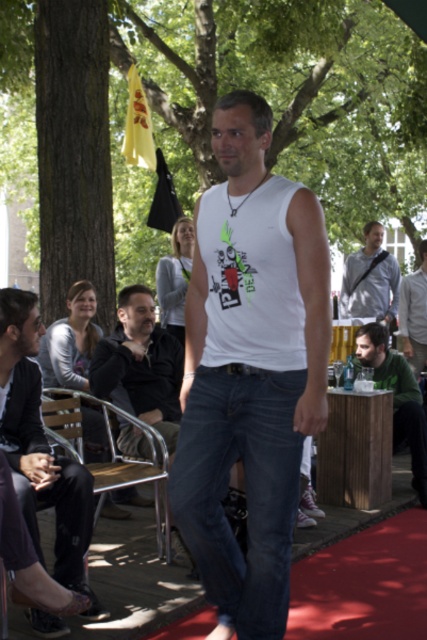
Question: Does white matte tank top at center have a larger size compared to woodenchair at left?

Choices:
 (A) no
 (B) yes

Answer: (A)

Question: Which object appears closest to the camera in this image?

Choices:
 (A) white matte shirt at center
 (B) light blue shirt at center
 (C) green textured shirt at center
 (D) dark gray sweater at left

Answer: (D)

Question: Among these points, which one is nearest to the camera?

Choices:
 (A) (102, 349)
 (B) (354, 266)
 (C) (82, 451)
 (D) (216, 380)

Answer: (D)

Question: Does dark gray jeans at lower left lie in front of light blue shirt at center?

Choices:
 (A) no
 (B) yes

Answer: (B)

Question: Which point is closer to the camera taking this photo?

Choices:
 (A) (98, 474)
 (B) (242, 198)
 (C) (368, 308)

Answer: (B)

Question: Is dark gray jeans at lower left wider than white matte shirt at center?

Choices:
 (A) no
 (B) yes

Answer: (B)